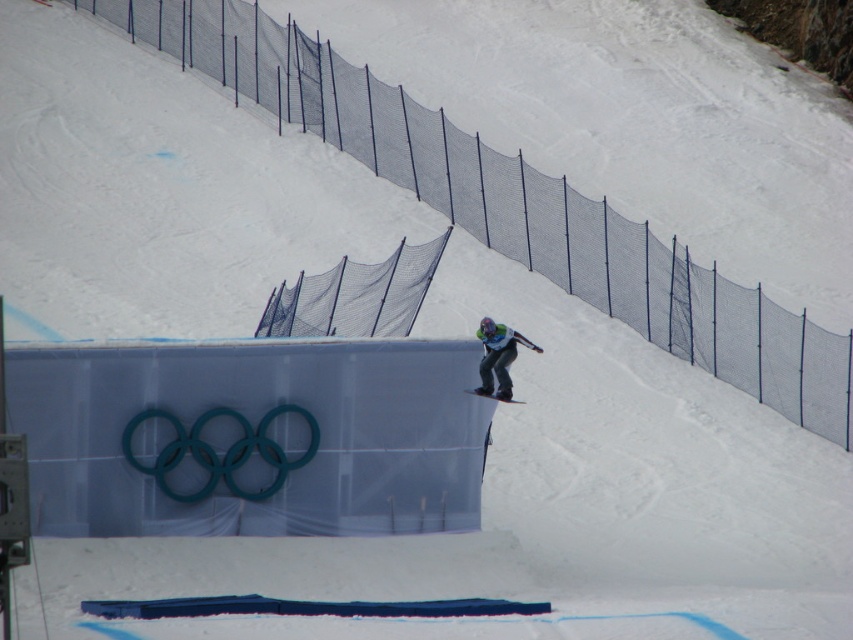
Question: Where is green fabric snowboarder at center located in relation to matte black snowboard at center in the image?

Choices:
 (A) left
 (B) right

Answer: (B)

Question: Among these points, which one is farthest from the camera?

Choices:
 (A) (515, 403)
 (B) (498, 337)

Answer: (B)

Question: Can you confirm if green fabric snowboarder at center is positioned below matte black snowboard at center?

Choices:
 (A) no
 (B) yes

Answer: (A)

Question: Which point appears closest to the camera in this image?

Choices:
 (A) (503, 339)
 (B) (477, 388)

Answer: (B)

Question: Is green fabric snowboarder at center closer to the viewer compared to matte black snowboard at center?

Choices:
 (A) no
 (B) yes

Answer: (B)